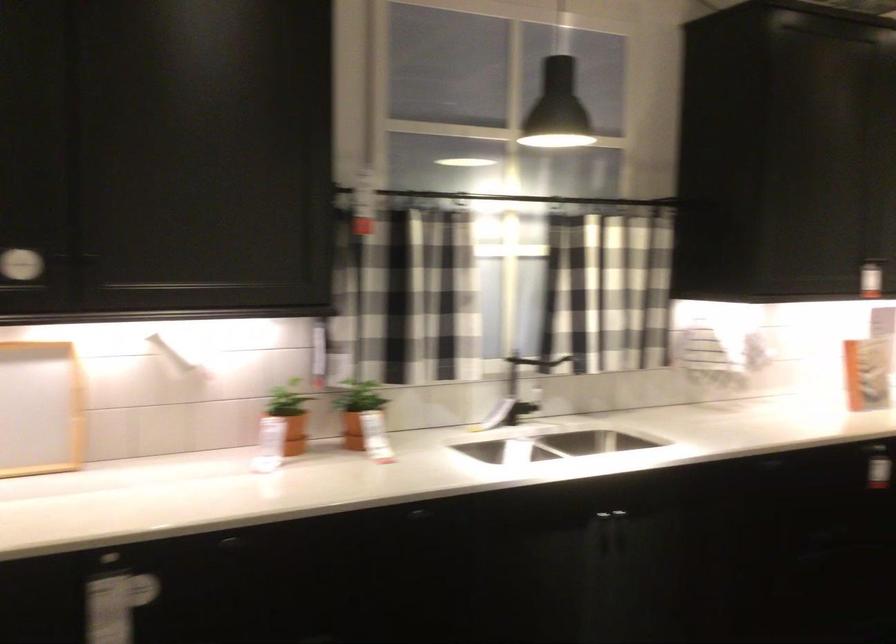
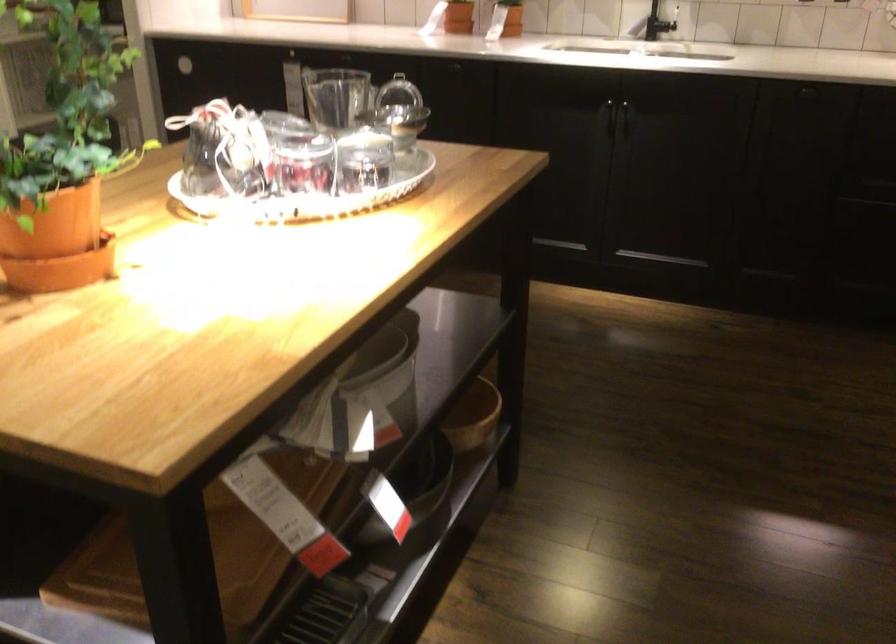
In the second image, find the point that corresponds to (595,526) in the first image.

(599, 107)